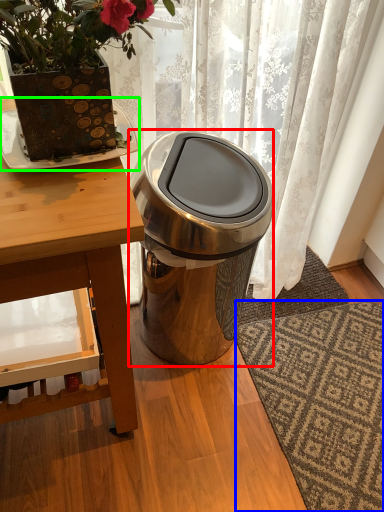
Question: Based on their relative distances, which object is farther from trash bin/can (highlighted by a red box)? Choose from doormat (highlighted by a blue box) and plate (highlighted by a green box).

Choices:
 (A) doormat
 (B) plate

Answer: (A)